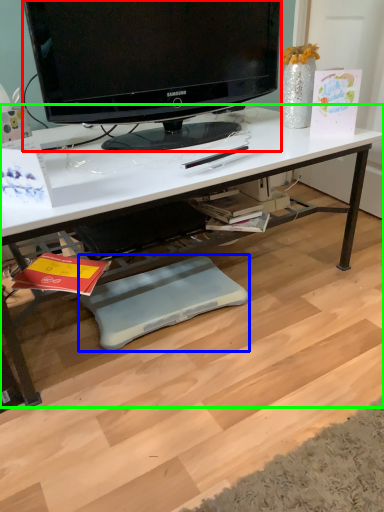
Question: Which object is positioned closest to television (highlighted by a red box)? Select from footrest (highlighted by a blue box) and desk (highlighted by a green box).

Choices:
 (A) footrest
 (B) desk

Answer: (B)